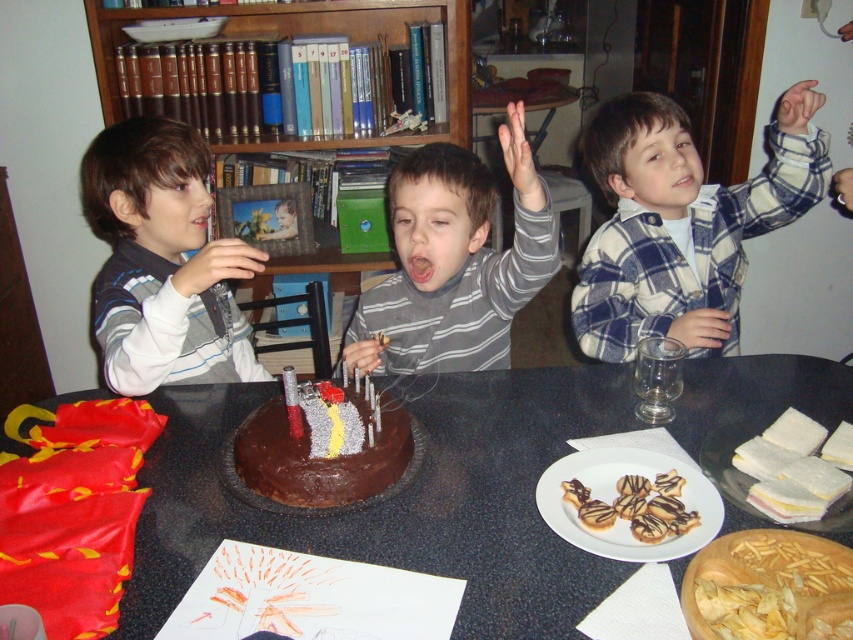
Which is more to the left, matte gray sweater at left or wooden bookshelf at upper center?

matte gray sweater at left

Who is more forward, (88, 154) or (263, 12)?

Point (88, 154) is in front.

Locate an element on the screen. The image size is (853, 640). matte gray sweater at left is located at coordinates (161, 262).

Locate an element on the screen. This screenshot has height=640, width=853. chocolate cake at center is located at coordinates (399, 499).

This screenshot has height=640, width=853. Describe the element at coordinates (399, 499) in the screenshot. I see `chocolate cake at center` at that location.

Is point (483, 620) less distant than point (369, 460)?

Yes, it is.

What are the coordinates of `chocolate cake at center` in the screenshot? It's located at (399, 499).

Which is more to the right, gray striped shirt at center or wooden bookshelf at upper center?

gray striped shirt at center is more to the right.

Which of these two, gray striped shirt at center or wooden bookshelf at upper center, stands shorter?

Standing shorter between the two is gray striped shirt at center.

Is point (506, 344) behind point (300, 266)?

No, it is in front of (300, 266).

Where is `gray striped shirt at center`? This screenshot has width=853, height=640. gray striped shirt at center is located at coordinates pos(454,260).